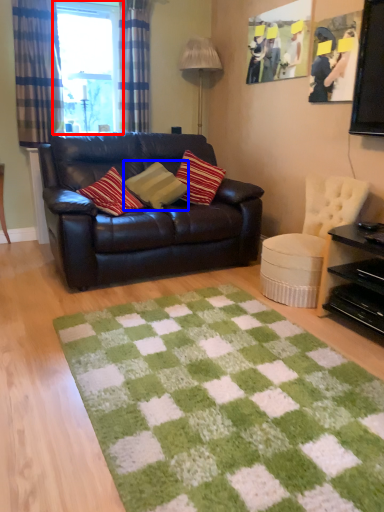
Question: Which of the following is the closest to the observer, window (highlighted by a red box) or pillow (highlighted by a blue box)?

Choices:
 (A) window
 (B) pillow

Answer: (B)